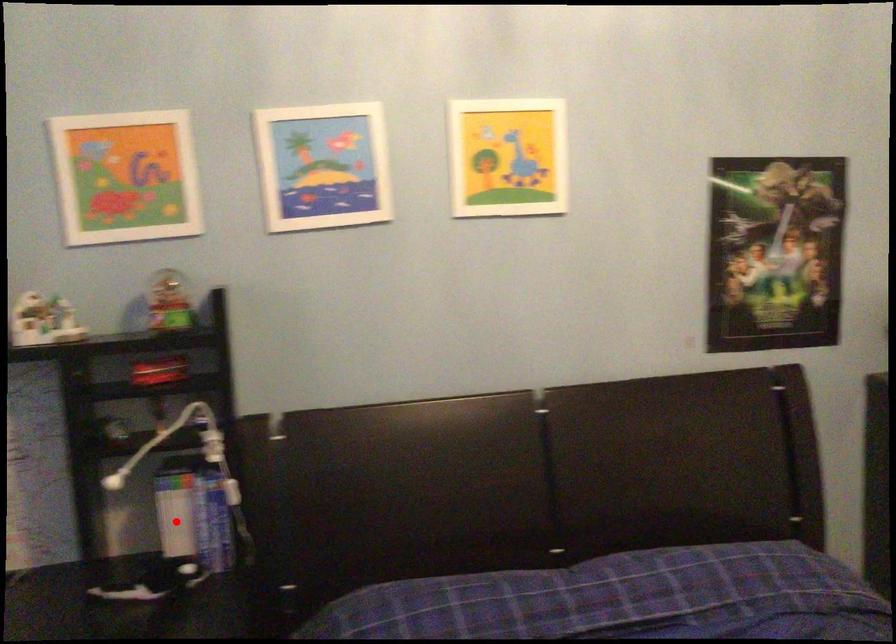
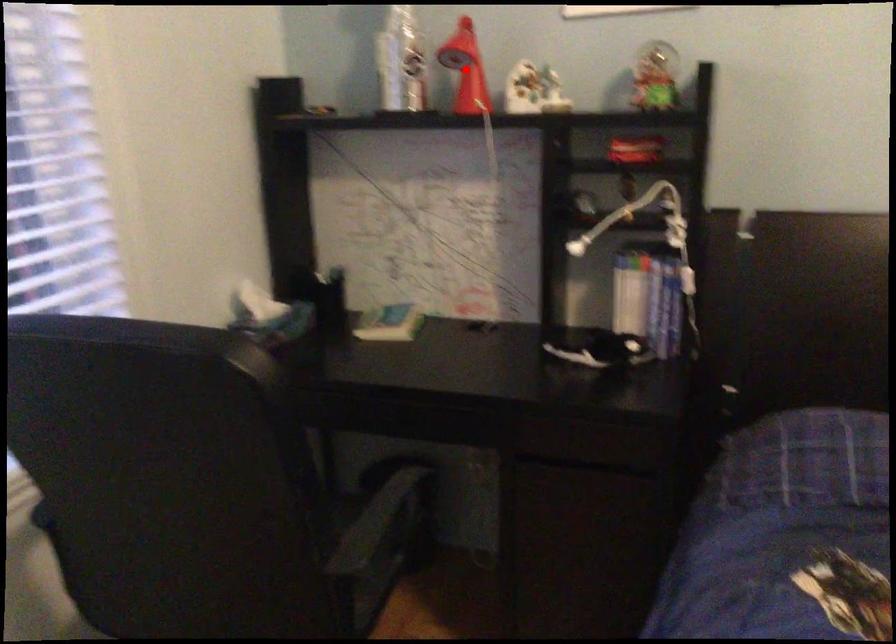
I am providing you with two images of the same scene from different viewpoints. A red point is marked on the first image and another point is marked on the second image. Is the red point in image1 aligned with the point shown in image2?

No